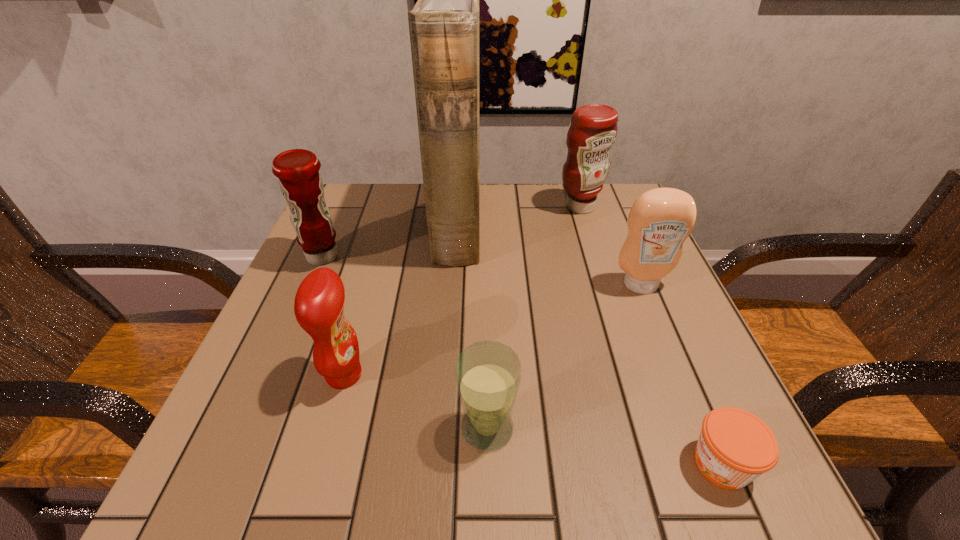
At what (x,y) coordinates should I click in order to perform the action: click on glass present at the near edge. Please return your answer as a coordinate pair (x, y). The width and height of the screenshot is (960, 540). Looking at the image, I should click on (488, 374).

This screenshot has width=960, height=540. Identify the location of jam at the near edge. (735, 447).

The image size is (960, 540). In order to click on jam that is positioned at the right edge in this screenshot , I will do `click(735, 447)`.

Locate an element on the screen. object at the far right corner is located at coordinates pos(593,129).

Locate an element on the screen. This screenshot has width=960, height=540. object that is at the near right corner is located at coordinates (735, 447).

Find the location of `vacant area at the far edge of the desktop`. vacant area at the far edge of the desktop is located at coordinates (558, 206).

In order to click on vacant space at the near edge of the desktop in this screenshot , I will do `click(522, 471)`.

Locate an element on the screen. The height and width of the screenshot is (540, 960). vacant area at the left edge is located at coordinates (318, 381).

The height and width of the screenshot is (540, 960). I want to click on blank space at the right edge of the desktop, so click(638, 381).

In the image, there is a desktop. Where is `free space at the far left corner`? This screenshot has height=540, width=960. free space at the far left corner is located at coordinates (366, 233).